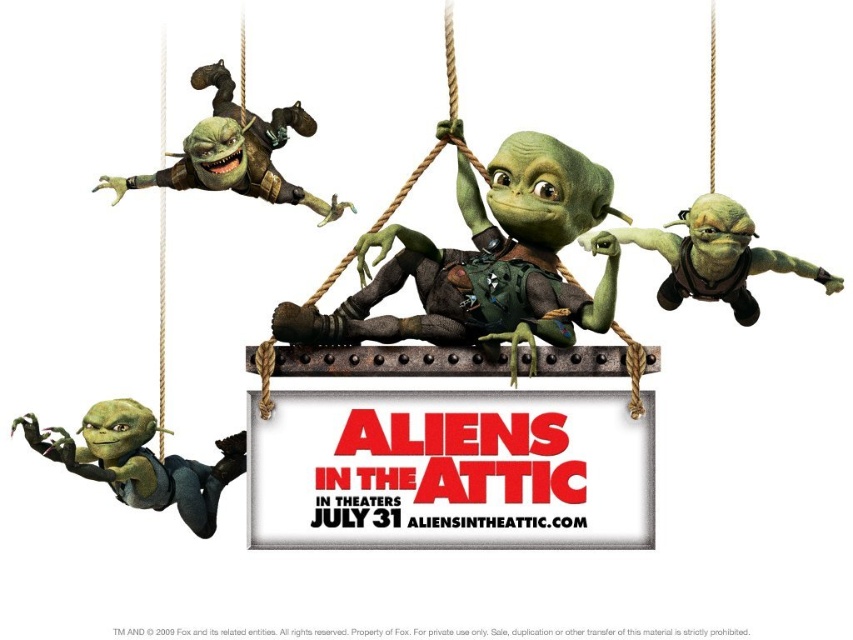
Question: Which object appears closest to the camera in this image?

Choices:
 (A) white cardboard sign at center
 (B) green matte alien at right
 (C) green matte alien at upper left

Answer: (A)

Question: Among these points, which one is nearest to the camera?

Choices:
 (A) (704, 276)
 (B) (328, 216)
 (C) (393, 230)
 (D) (137, 403)

Answer: (C)

Question: Does matte green alien at center come behind green matte alien at lower left?

Choices:
 (A) no
 (B) yes

Answer: (A)

Question: Can you confirm if white cardboard sign at center is smaller than green matte alien at right?

Choices:
 (A) no
 (B) yes

Answer: (B)

Question: Which is nearer to the green matte alien at lower left?

Choices:
 (A) green matte alien at upper left
 (B) green matte alien at right
 (C) matte green alien at center

Answer: (A)

Question: Can you confirm if green matte alien at lower left is positioned below green matte alien at right?

Choices:
 (A) no
 (B) yes

Answer: (B)